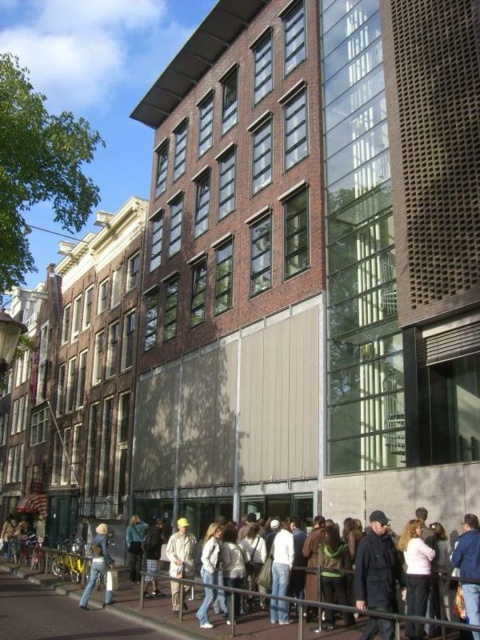
You are a delivery person trying to place a package on the street. You see a white cotton jacket at lower center and a light brown leather jacket at lower left. Can you place the package between them?

The white cotton jacket at lower center is positioned over the light brown leather jacket at lower left, meaning they are stacked rather than separated by space. Therefore, you cannot place the package between them.

You are standing on the street looking at the buildings. You see a denim jacket at lower left and blue denim jeans at lower center. Which item is nearer to you?

The denim jacket at lower left is closer to the viewer than the blue denim jeans at lower center.

You are a fashion designer looking at the image and want to create a layered outfit. Which item is placed on top of the other between the khaki fabric pants at center and the denim jacket at lower left?

The khaki fabric pants at center is positioned over the denim jacket at lower left, so it is the top layer in the outfit.